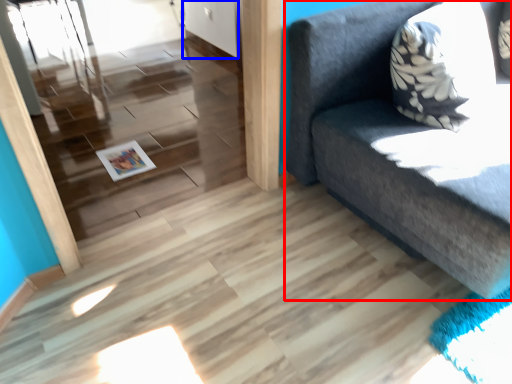
Question: Which object is further to the camera taking this photo, studio couch (highlighted by a red box) or door (highlighted by a blue box)?

Choices:
 (A) studio couch
 (B) door

Answer: (B)